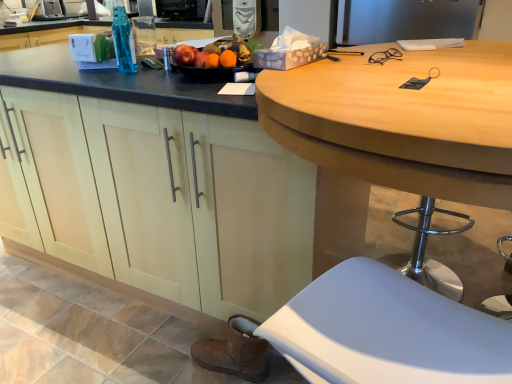
Question: Considering their positions, is brown suede boot at lower left located in front of or behind white plastic stool at lower right?

Choices:
 (A) front
 (B) behind

Answer: (B)

Question: Would you say brown suede boot at lower left is to the left or to the right of white plastic stool at lower right in the picture?

Choices:
 (A) left
 (B) right

Answer: (A)

Question: Based on their relative distances, which object is nearer to the brown suede boot at lower left?

Choices:
 (A) brushed metal sink at upper left
 (B) wooden desk at center
 (C) white plastic stool at lower right
 (D) matte wood cabinets at center
 (E) clear plastic glasses at upper right

Answer: (D)

Question: Which object is the closest to the clear plastic glasses at upper right?

Choices:
 (A) matte wood cabinets at center
 (B) brown suede boot at lower left
 (C) translucent plastic bottle at upper center
 (D) glossy wooden tray of fruits at center
 (E) brushed metal sink at upper left

Answer: (D)